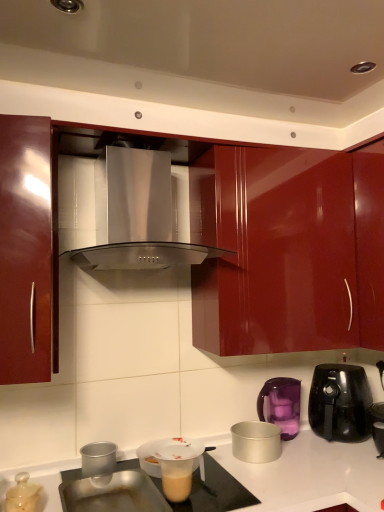
Question: Is purple plastic kettle at right, positioned as the second kitchen appliance in right-to-left order, taller or shorter than glossy red cabinet at left?

Choices:
 (A) short
 (B) tall

Answer: (A)

Question: Is point (261, 392) positioned closer to the camera than point (28, 167)?

Choices:
 (A) farther
 (B) closer

Answer: (A)

Question: Which is nearer to the purple plastic kettle at right, which is the fourth kitchen appliance from left to right?

Choices:
 (A) stainless steel range hood at center
 (B) silver metallic pot at lower center, positioned as the 3th kitchen appliance in left-to-right order
 (C) black glossy air fryer at right, acting as the 1th kitchen appliance starting from the right
 (D) metallic silver cup at lower left, placed as the 2th kitchen appliance when sorted from left to right
 (E) glossy red cabinet at left

Answer: (C)

Question: Considering the real-world distances, which object is closest to the stainless steel range hood at center?

Choices:
 (A) silver metallic pot at lower center, positioned as the 3th kitchen appliance in left-to-right order
 (B) translucent plastic lid at lower left, marked as the 5th kitchen appliance in a right-to-left arrangement
 (C) purple plastic kettle at right, positioned as the second kitchen appliance in right-to-left order
 (D) black glossy air fryer at right, acting as the 1th kitchen appliance starting from the right
 (E) glossy red cabinet at left

Answer: (E)